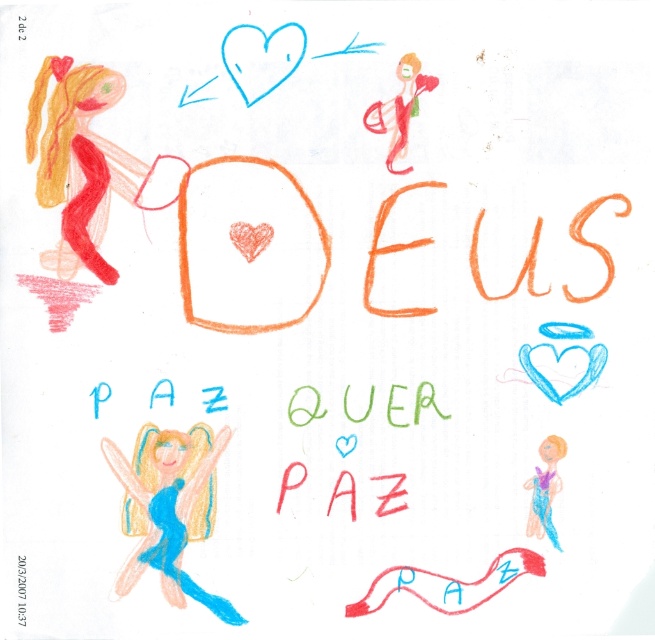
In the drawing, there are a blue paper fairy at lower left and a matte red doll at upper right. Which object is taller?

The blue paper fairy at lower left is taller than the matte red doll at upper right.

In the drawing, there is a blue paper fairy at lower left and a pastel purple fabric girl at lower right. Which one is positioned more to the left?

The blue paper fairy at lower left is positioned more to the left than the pastel purple fabric girl at lower right.

You are standing in front of the image and see the two points labeled as point (210, 440) and point (409, 56). Which point is closer to you?

Point (210, 440) is closer to you because it is in front of point (409, 56).